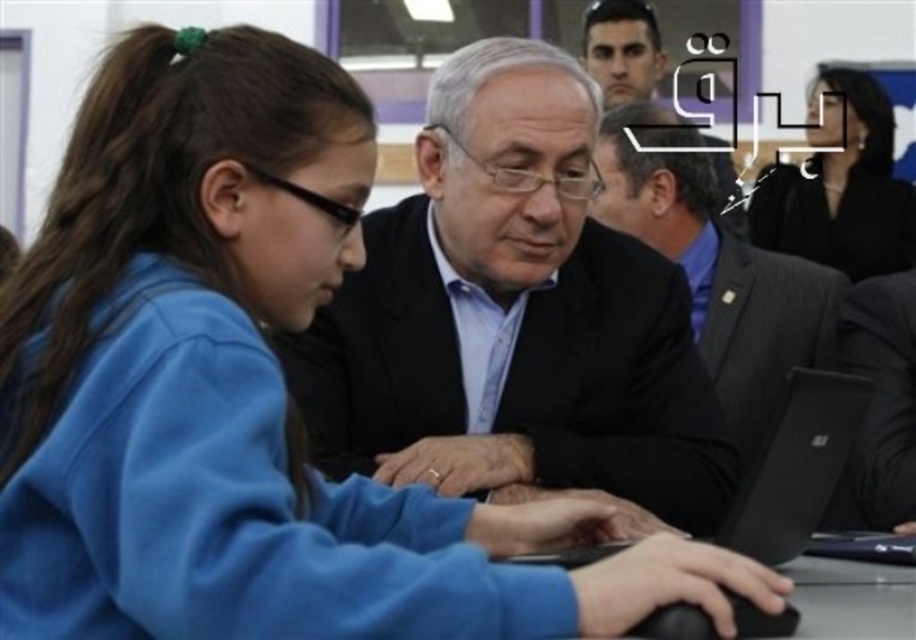
Consider the image. Is black glossy hair at upper right further to the viewer compared to dark suit at center?

No, it is not.

Which of these two, black glossy hair at upper right or dark suit at center, stands shorter?

With less height is dark suit at center.

The image size is (916, 640). Find the location of `black glossy hair at upper right`. black glossy hair at upper right is located at coordinates (841, 186).

Which is below, matte black suit at center or black glossy hair at upper right?

matte black suit at center is lower down.

This screenshot has width=916, height=640. What are the coordinates of `matte black suit at center` in the screenshot? It's located at (511, 317).

Does dark gray suit at center have a greater height compared to black matte laptop at center?

Correct, dark gray suit at center is much taller as black matte laptop at center.

Is dark gray suit at center smaller than black matte laptop at center?

No.

Is point (609, 161) farther from camera compared to point (754, 493)?

Yes, point (609, 161) is behind point (754, 493).

Locate an element on the screen. dark gray suit at center is located at coordinates (718, 275).